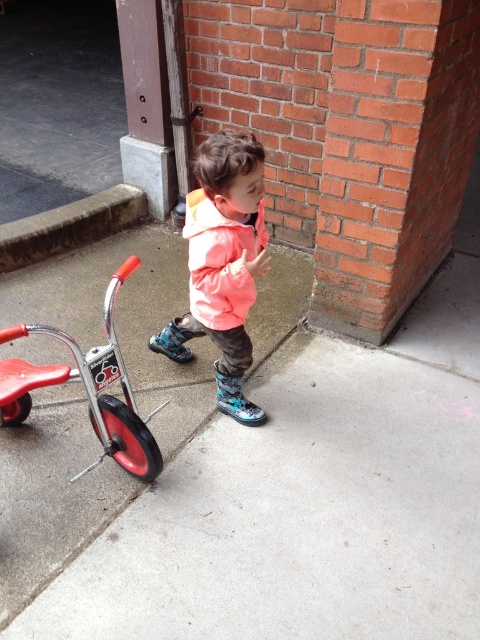
Image resolution: width=480 pixels, height=640 pixels. What are the coordinates of `matte orange jacket at center` in the screenshot? It's located at (223, 264).

Does point (228, 388) come behind point (123, 442)?

Yes, it is behind point (123, 442).

Identify the location of matte orange jacket at center. (223, 264).